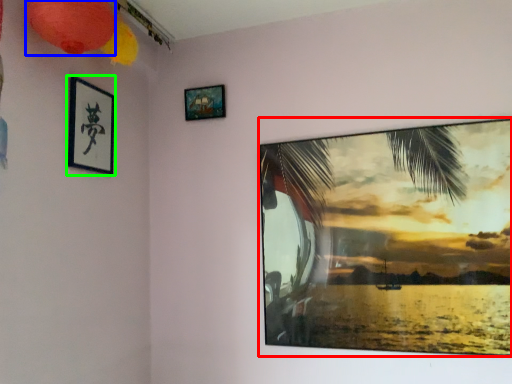
Question: Estimate the real-world distances between objects in this image. Which object is closer to picture frame (highlighted by a red box), lantern (highlighted by a blue box) or picture frame (highlighted by a green box)?

Choices:
 (A) lantern
 (B) picture frame

Answer: (B)